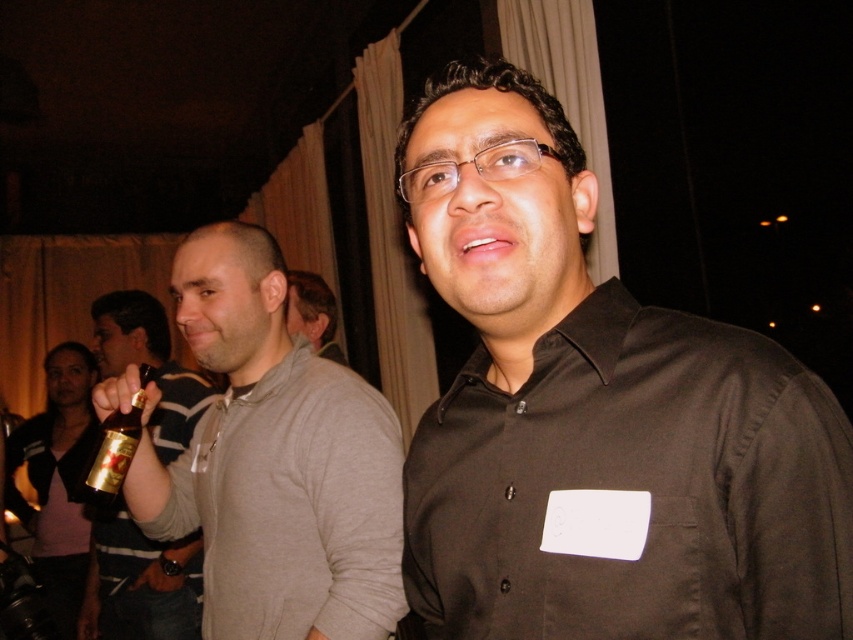
Is black matte shirt at center to the left of gold metallic bottle at left from the viewer's perspective?

No, black matte shirt at center is not to the left of gold metallic bottle at left.

What do you see at coordinates (598, 412) in the screenshot? I see `black matte shirt at center` at bounding box center [598, 412].

Identify the location of black matte shirt at center. (598, 412).

Can you confirm if gray cotton sweater at left is positioned to the left of gold metallic bottle at left?

No, gray cotton sweater at left is not to the left of gold metallic bottle at left.

Is gray cotton sweater at left wider than gold metallic bottle at left?

In fact, gray cotton sweater at left might be narrower than gold metallic bottle at left.

Who is more distant from viewer, (242, 246) or (138, 294)?

Point (138, 294)

I want to click on gray cotton sweater at left, so click(276, 461).

Between gray cotton sweater at left and light brown sweater at center, which one is positioned higher?

light brown sweater at center is higher up.

Between gray cotton sweater at left and light brown sweater at center, which one appears on the right side from the viewer's perspective?

gray cotton sweater at left is more to the right.

Is point (175, 470) behind point (320, 276)?

No, (175, 470) is in front of (320, 276).

The width and height of the screenshot is (853, 640). Find the location of `gray cotton sweater at left`. gray cotton sweater at left is located at coordinates (276, 461).